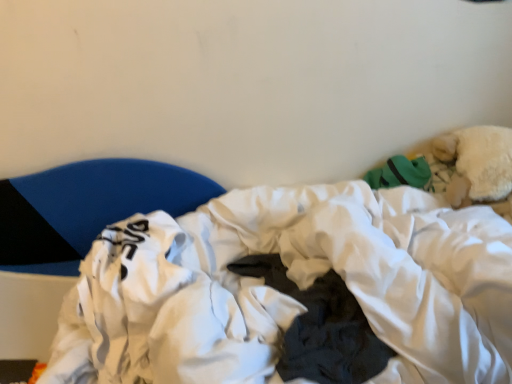
Question: Is white soft fabric at center positioned in front of blue fabric pillow at left?

Choices:
 (A) yes
 (B) no

Answer: (A)

Question: Is white soft fabric at center placed right next to blue fabric pillow at left?

Choices:
 (A) yes
 (B) no

Answer: (B)

Question: Is white soft fabric at center not within blue fabric pillow at left?

Choices:
 (A) no
 (B) yes

Answer: (B)

Question: Considering the relative positions of white soft fabric at center and blue fabric pillow at left in the image provided, is white soft fabric at center behind blue fabric pillow at left?

Choices:
 (A) no
 (B) yes

Answer: (A)

Question: Is white soft fabric at center to the left of blue fabric pillow at left from the viewer's perspective?

Choices:
 (A) no
 (B) yes

Answer: (A)

Question: Could blue fabric pillow at left be considered to be inside white soft fabric at center?

Choices:
 (A) yes
 (B) no

Answer: (B)

Question: Considering the relative positions of blue fabric pillow at left and white soft fabric at center in the image provided, is blue fabric pillow at left to the right of white soft fabric at center from the viewer's perspective?

Choices:
 (A) yes
 (B) no

Answer: (B)

Question: From the image's perspective, does blue fabric pillow at left appear lower than white soft fabric at center?

Choices:
 (A) yes
 (B) no

Answer: (B)

Question: Is the surface of blue fabric pillow at left in direct contact with white soft fabric at center?

Choices:
 (A) yes
 (B) no

Answer: (B)

Question: Is blue fabric pillow at left to the left of white soft fabric at center from the viewer's perspective?

Choices:
 (A) yes
 (B) no

Answer: (A)

Question: Does blue fabric pillow at left have a lesser width compared to white soft fabric at center?

Choices:
 (A) yes
 (B) no

Answer: (A)

Question: Is white soft fabric at center located within blue fabric pillow at left?

Choices:
 (A) yes
 (B) no

Answer: (B)

Question: Looking at the image, does blue fabric pillow at left seem bigger or smaller compared to white soft fabric at center?

Choices:
 (A) big
 (B) small

Answer: (B)